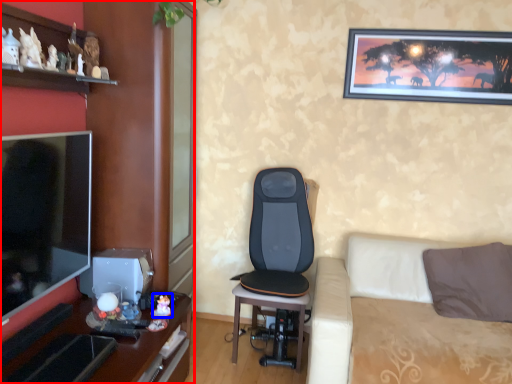
Question: Among these objects, which one is farthest to the camera, entertainment center (highlighted by a red box) or toy (highlighted by a blue box)?

Choices:
 (A) entertainment center
 (B) toy

Answer: (B)